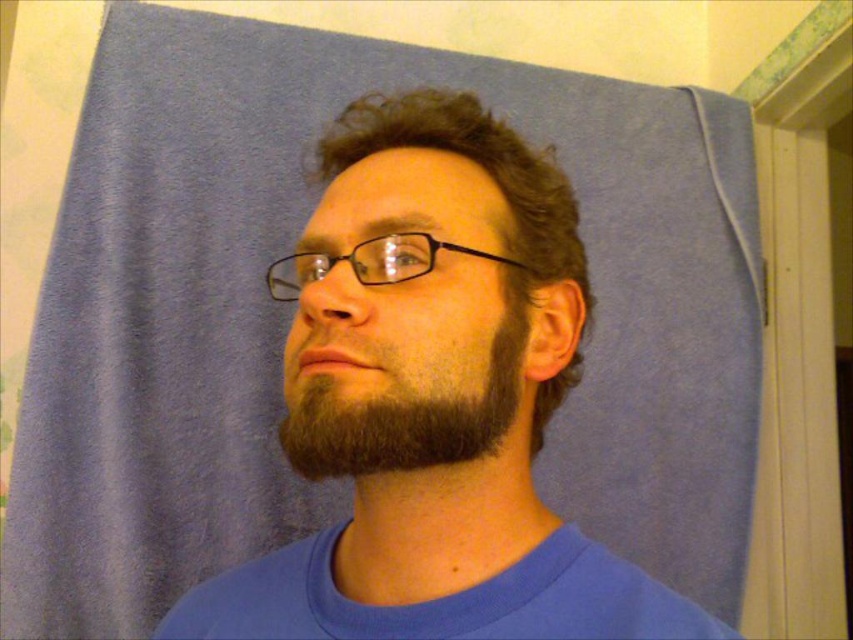
You are a GUI agent. You are given a task and a screenshot of the screen. Output one action in this format:
    pyautogui.click(x=<x>, y=<y>)
    Task: Click on the blue matte shirt at center
    The width and height of the screenshot is (853, 640).
    Given the screenshot: What is the action you would take?
    pyautogui.click(x=433, y=397)

Is point (560, 378) less distant than point (291, 273)?

Yes, point (560, 378) is in front of point (291, 273).

Can you confirm if dark brown curly hair at center is smaller than black plastic glasses at center?

No.

Is point (583, 273) less distant than point (370, 244)?

No.

This screenshot has width=853, height=640. I want to click on dark brown curly hair at center, so click(473, 163).

Is point (376, 436) positioned in front of point (364, 269)?

Yes.

Does dark brown fuzzy beard at center appear on the left side of black plastic glasses at center?

No, dark brown fuzzy beard at center is not to the left of black plastic glasses at center.

Where is `dark brown fuzzy beard at center`? dark brown fuzzy beard at center is located at coordinates (405, 419).

This screenshot has width=853, height=640. Identify the location of dark brown fuzzy beard at center. (405, 419).